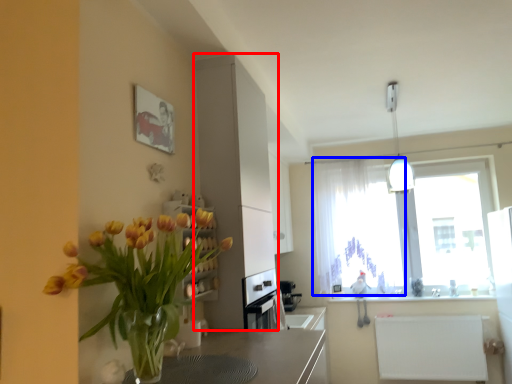
Question: Which point is further to the camera, cabinetry (highlighted by a red box) or curtain (highlighted by a blue box)?

Choices:
 (A) cabinetry
 (B) curtain

Answer: (B)